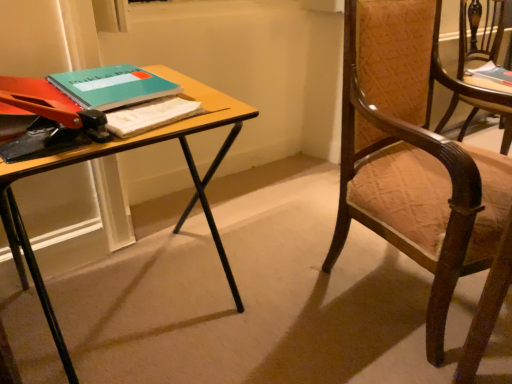
Question: Is teal matte notebook at upper left, the 2th book viewed from the back, surrounding teal matte book at upper right, the second book from the front?

Choices:
 (A) yes
 (B) no

Answer: (B)

Question: Would you say teal matte notebook at upper left, arranged as the first book when viewed from the front, is outside teal matte book at upper right, placed as the 2th book when sorted from bottom to top?

Choices:
 (A) no
 (B) yes

Answer: (B)

Question: From a real-world perspective, does teal matte notebook at upper left, arranged as the first book when viewed from the front, stand above teal matte book at upper right, which is the first book in right-to-left order?

Choices:
 (A) no
 (B) yes

Answer: (B)

Question: Does teal matte notebook at upper left, arranged as the first book when viewed from the front, have a greater height compared to teal matte book at upper right, positioned as the first book in top-to-bottom order?

Choices:
 (A) no
 (B) yes

Answer: (A)

Question: Can you confirm if teal matte notebook at upper left, arranged as the second book when viewed from the right, is smaller than teal matte book at upper right, the 1th book positioned from the back?

Choices:
 (A) no
 (B) yes

Answer: (B)

Question: In the image, is wooden chair with upholstered seat at right, positioned as the second chair in right-to-left order, on the left side or the right side of wooden desk at center?

Choices:
 (A) right
 (B) left

Answer: (A)

Question: Is wooden chair with upholstered seat at right, which appears as the 2th chair when viewed from the back, in front of or behind wooden desk at center in the image?

Choices:
 (A) front
 (B) behind

Answer: (B)

Question: From a real-world perspective, is wooden chair with upholstered seat at right, which is counted as the 1th chair, starting from the front, physically located above or below wooden desk at center?

Choices:
 (A) below
 (B) above

Answer: (B)

Question: Is wooden chair with upholstered seat at right, which appears as the 2th chair when viewed from the back, situated inside wooden desk at center or outside?

Choices:
 (A) outside
 (B) inside

Answer: (A)

Question: Is wooden textured chair at right, which is counted as the 1th chair, starting from the back, inside the boundaries of wooden desk at center, or outside?

Choices:
 (A) outside
 (B) inside

Answer: (A)

Question: From the image's perspective, is wooden textured chair at right, the second chair when ordered from left to right, above or below wooden desk at center?

Choices:
 (A) above
 (B) below

Answer: (A)

Question: Is wooden textured chair at right, the second chair from the front, in front of or behind wooden desk at center in the image?

Choices:
 (A) front
 (B) behind

Answer: (B)

Question: Based on their positions, is wooden textured chair at right, the second chair when ordered from left to right, located to the left or right of wooden desk at center?

Choices:
 (A) right
 (B) left

Answer: (A)

Question: Considering the positions of teal matte notebook at upper left, arranged as the second book when viewed from the right, and teal matte book at upper right, placed as the 2th book when sorted from bottom to top, in the image, is teal matte notebook at upper left, arranged as the second book when viewed from the right, bigger or smaller than teal matte book at upper right, placed as the 2th book when sorted from bottom to top,?

Choices:
 (A) big
 (B) small

Answer: (B)

Question: Is teal matte notebook at upper left, which is the first book from bottom to top, wider or thinner than teal matte book at upper right, which is the first book in right-to-left order?

Choices:
 (A) thin
 (B) wide

Answer: (A)